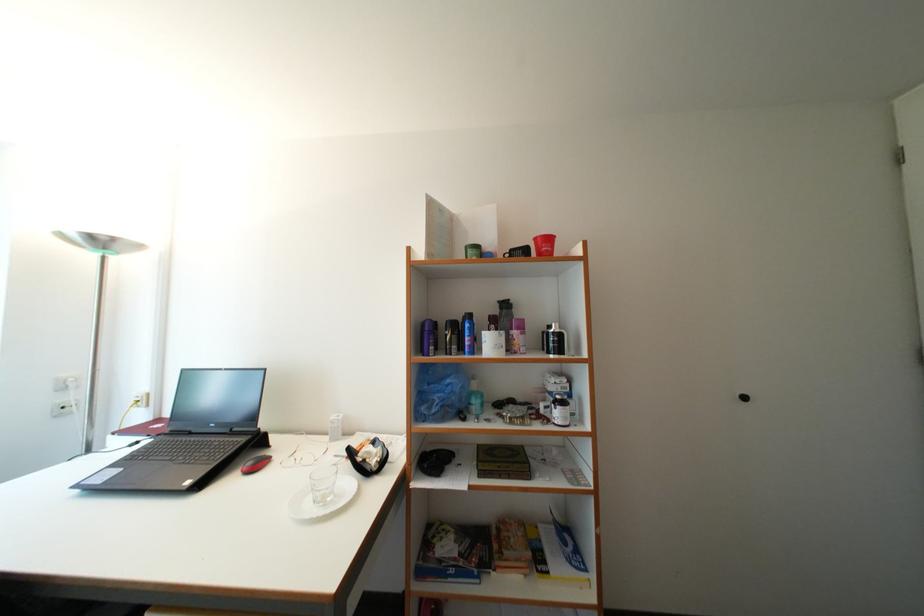
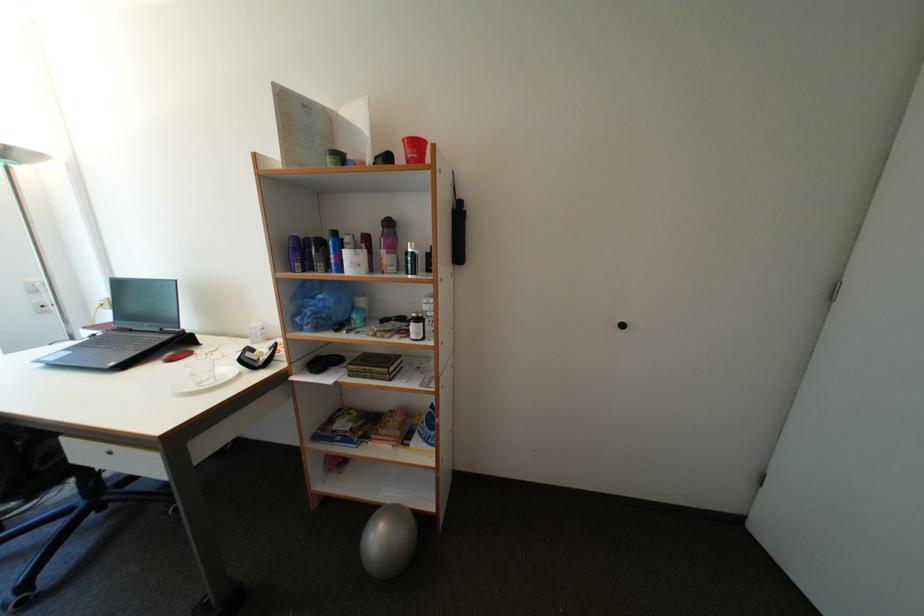
Question: In a continuous first-person perspective shot, in which direction is the camera moving?

Choices:
 (A) Left
 (B) Right
 (C) Forward
 (D) Backward

Answer: (B)